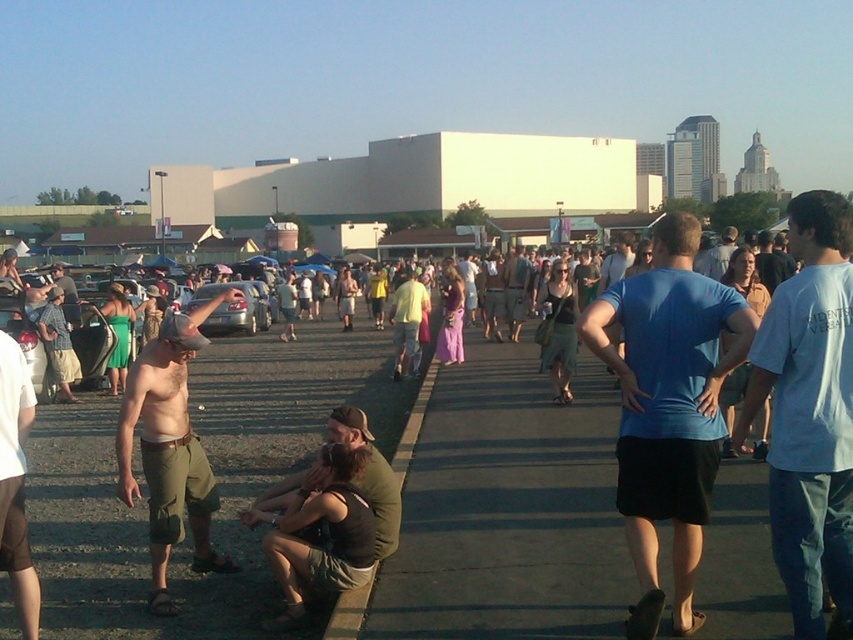
Between blue t-shirt at center and green cotton shorts at lower left, which one has more height?

With more height is blue t-shirt at center.

Between blue t-shirt at center and green cotton shorts at lower left, which one appears on the right side from the viewer's perspective?

blue t-shirt at center

The width and height of the screenshot is (853, 640). I want to click on blue t-shirt at center, so click(x=668, y=406).

Describe the element at coordinates (668, 406) in the screenshot. I see `blue t-shirt at center` at that location.

Is blue t-shirt at center further to the viewer compared to white cotton t-shirt at center-right?

Yes.

Image resolution: width=853 pixels, height=640 pixels. I want to click on blue t-shirt at center, so [668, 406].

Locate an element on the screen. Image resolution: width=853 pixels, height=640 pixels. blue t-shirt at center is located at coordinates (668, 406).

Between white cotton t-shirt at center-right and green canvas jacket at lower center, which one appears on the right side from the viewer's perspective?

From the viewer's perspective, white cotton t-shirt at center-right appears more on the right side.

Does point (817, 552) lie in front of point (387, 502)?

Yes, it is in front of point (387, 502).

Find the location of a particular element. This screenshot has height=640, width=853. white cotton t-shirt at center-right is located at coordinates (809, 413).

You are a GUI agent. You are given a task and a screenshot of the screen. Output one action in this format:
    pyautogui.click(x=<x>, y=<y>)
    Task: Click on the white cotton t-shirt at center-right
    
    Given the screenshot: What is the action you would take?
    pyautogui.click(x=809, y=413)